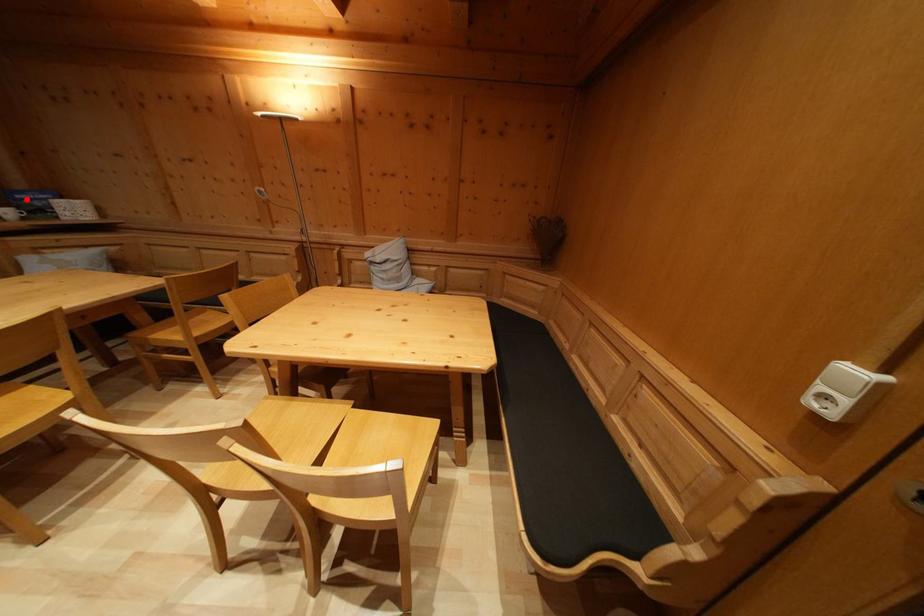
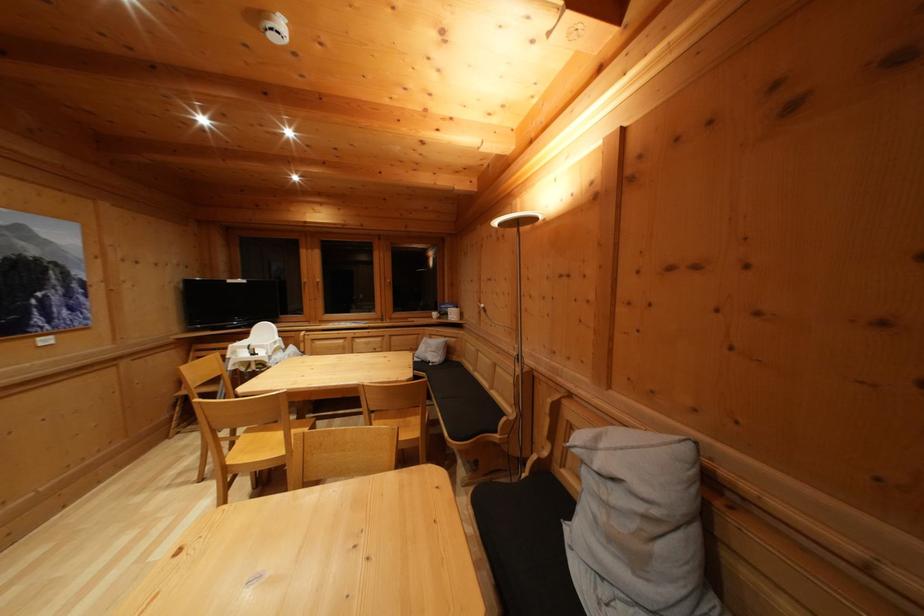
The point at the highlighted location is marked in the first image. Where is the corresponding point in the second image?

(450, 310)